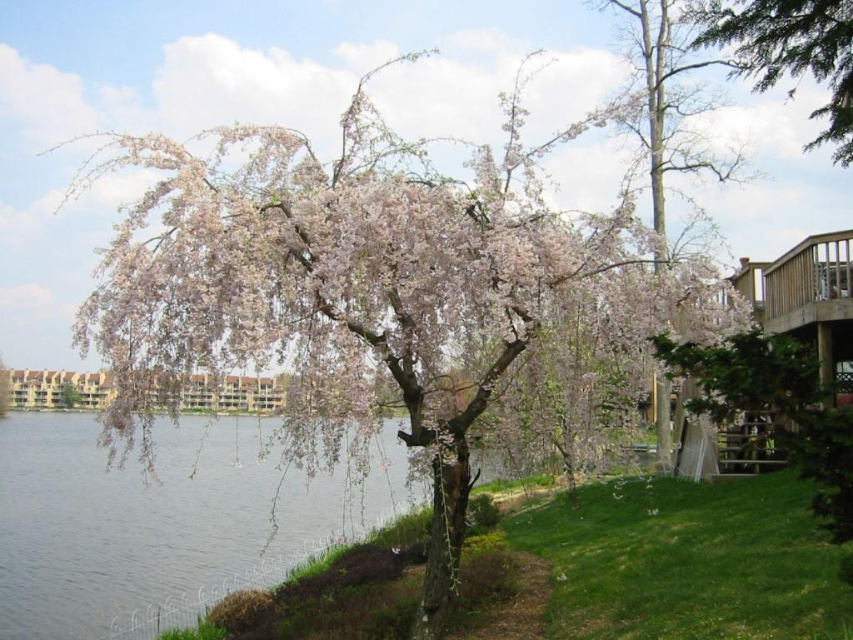
You are planning to place a small boat in the scene. The boat requires a space wider than the green textured tree at upper right. Can the clear water at lower left accommodate the boat?

The clear water at lower left has a width that surpasses the green textured tree at upper right, so yes, the boat can be placed there as it has sufficient width.